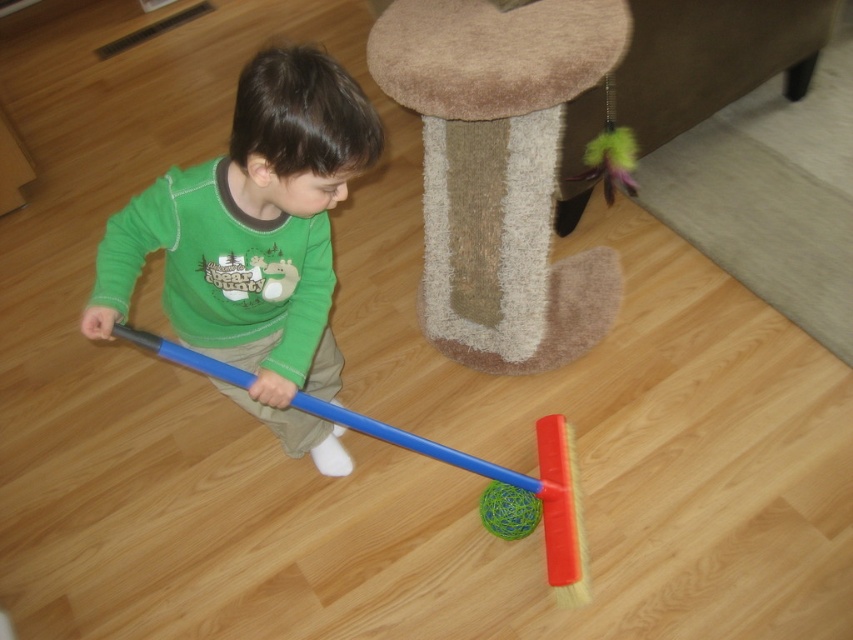
You are a parent trying to choose between the green matte shirt at center and the blue plastic broom at center for your child to play with. Which item is narrower?

The green matte shirt at center is thinner than the blue plastic broom at center, so the green matte shirt at center is narrower.